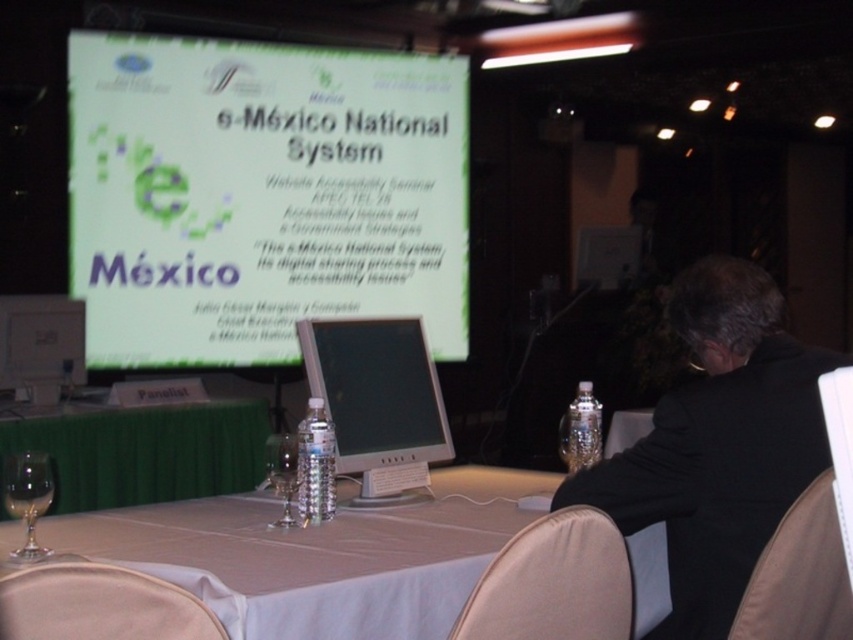
Is black suit at right positioned behind beige fabric chair at lower right?

Yes, black suit at right is further from the viewer.

Can you confirm if black suit at right is taller than beige fabric chair at lower right?

Yes, black suit at right is taller than beige fabric chair at lower right.

Does point (666, 636) lie in front of point (795, 541)?

No, (666, 636) is behind (795, 541).

The height and width of the screenshot is (640, 853). Identify the location of black suit at right. (718, 444).

Can you confirm if beige fabric chair at lower right is positioned to the right of clear glass wine glass at lower left?

Indeed, beige fabric chair at lower right is positioned on the right side of clear glass wine glass at lower left.

Can you confirm if beige fabric chair at lower right is positioned below clear glass wine glass at lower left?

Yes.

Does point (845, 621) come closer to viewer compared to point (16, 456)?

Yes, it is.

Where is `beige fabric chair at lower right`? This screenshot has width=853, height=640. beige fabric chair at lower right is located at coordinates (799, 576).

Does white glossy projection screen at upper center appear on the right side of white plastic table at center?

Yes, white glossy projection screen at upper center is to the right of white plastic table at center.

Which of these two, white glossy projection screen at upper center or white plastic table at center, stands taller?

With more height is white glossy projection screen at upper center.

Does point (418, 275) come farther from viewer compared to point (260, 476)?

Yes, point (418, 275) is behind point (260, 476).

I want to click on white glossy projection screen at upper center, so click(260, 195).